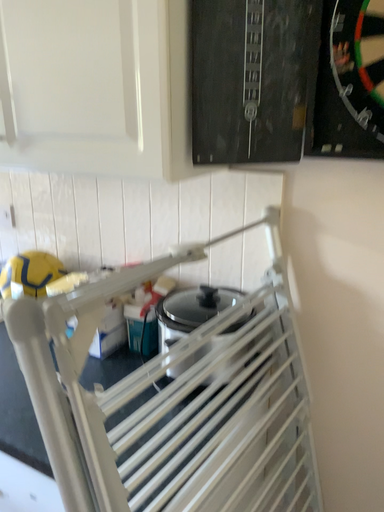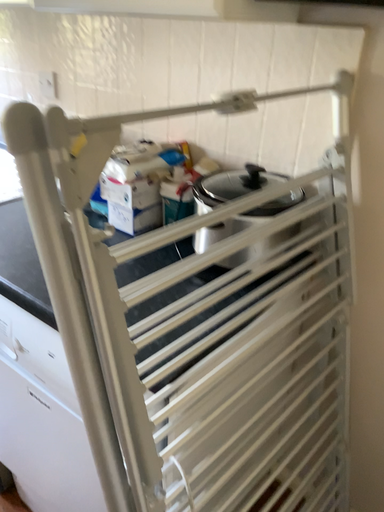
Question: Which way did the camera rotate in the video?

Choices:
 (A) rotated upward
 (B) rotated downward

Answer: (B)